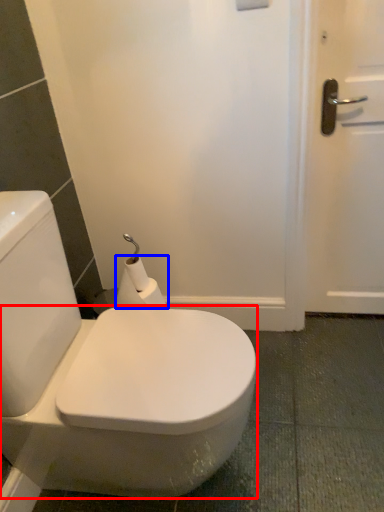
Question: Which of the following is the closest to the observer, bidet (highlighted by a red box) or toilet paper (highlighted by a blue box)?

Choices:
 (A) bidet
 (B) toilet paper

Answer: (A)